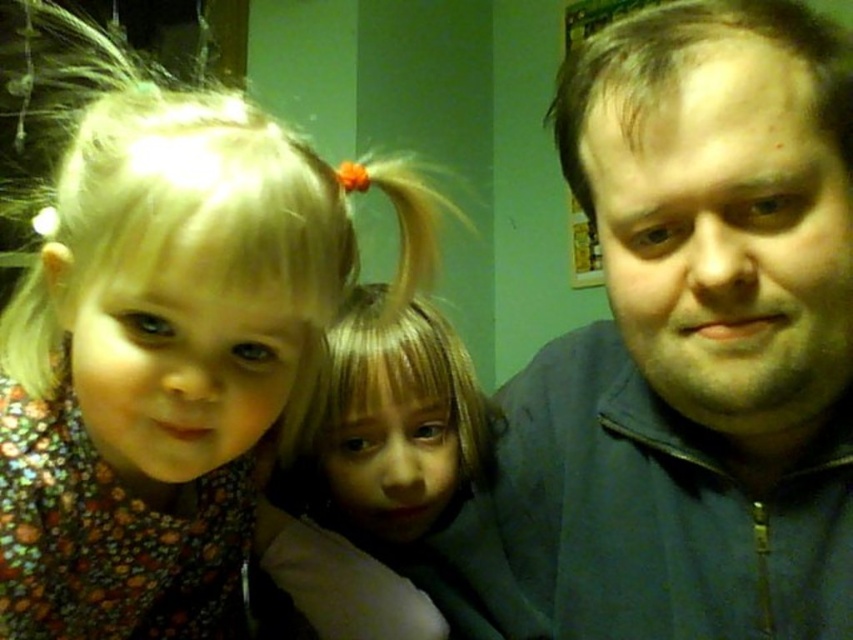
You are standing in front of the image and want to touch the point at coordinates point [59,296]. Can you reach it with your hand if your arm can extend 20 inches?

The point [59,296] is 19.04 inches away from the viewer, so yes, you can reach it with your hand since your arm can extend 20 inches.